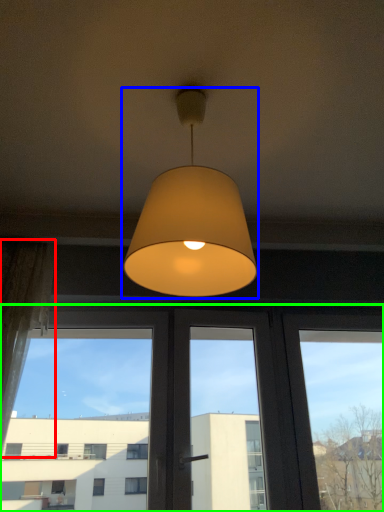
Question: Based on their relative distances, which object is farther from curtain (highlighted by a red box)? Choose from lamp (highlighted by a blue box) and window (highlighted by a green box).

Choices:
 (A) lamp
 (B) window

Answer: (A)